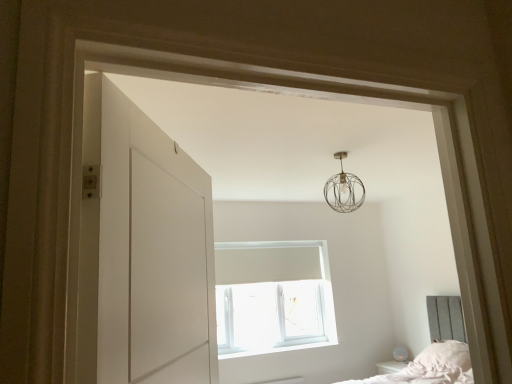
What are the coordinates of `vacant region above metallic wire sphere at upper center (from a real-world perspective)` in the screenshot? It's located at (346, 151).